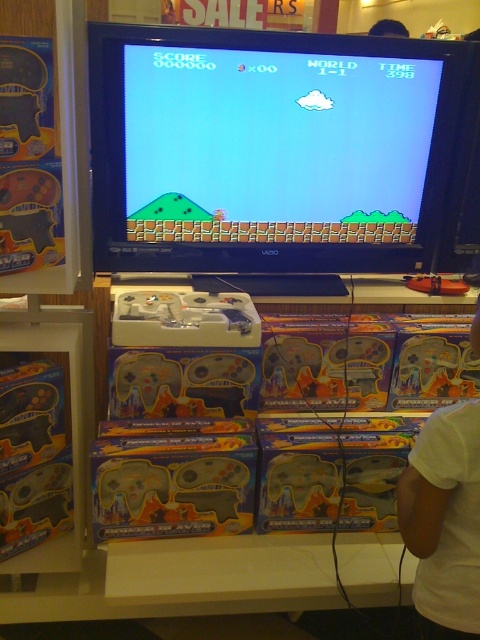
Question: Is matte plastic video game at center positioned at the back of white cotton shirt at lower right?

Choices:
 (A) no
 (B) yes

Answer: (B)

Question: Can you confirm if matte plastic video game at center is bigger than white cotton shirt at lower right?

Choices:
 (A) yes
 (B) no

Answer: (A)

Question: Is matte plastic video game at center to the left of white cotton shirt at lower right from the viewer's perspective?

Choices:
 (A) yes
 (B) no

Answer: (A)

Question: Among these points, which one is farthest from the camera?

Choices:
 (A) (439, 545)
 (B) (132, 232)

Answer: (B)